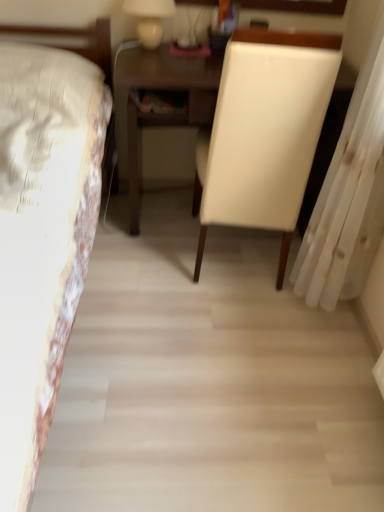
Locate an element on the screen. The image size is (384, 512). unoccupied area in front of white leather chair at center is located at coordinates (217, 329).